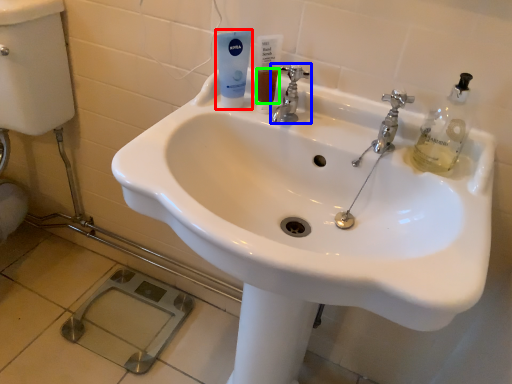
Question: Based on their relative distances, which object is farther from mouthwash (highlighted by a red box)? Choose from tap (highlighted by a blue box) and liquid (highlighted by a green box).

Choices:
 (A) tap
 (B) liquid

Answer: (A)